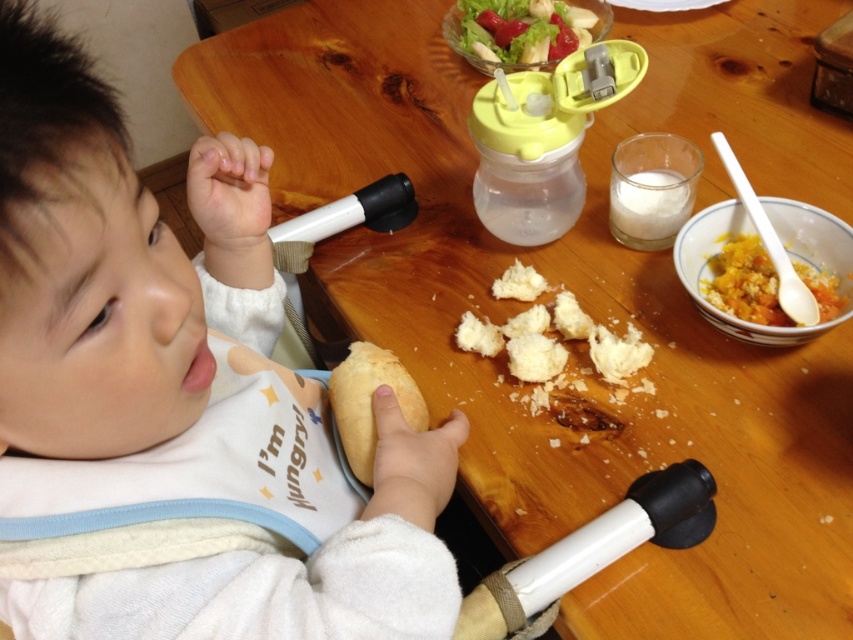
Who is higher up, fresh green lettuce at upper center or orange mashed food at right?

fresh green lettuce at upper center

Can you confirm if fresh green lettuce at upper center is positioned below orange mashed food at right?

Incorrect, fresh green lettuce at upper center is not positioned below orange mashed food at right.

At what (x,y) coordinates should I click in order to perform the action: click on fresh green lettuce at upper center. Please return your answer as a coordinate pair (x, y). Looking at the image, I should click on (521, 29).

Locate an element on the screen. The image size is (853, 640). white soft bread at lower right is located at coordinates (125, 278).

This screenshot has width=853, height=640. In order to click on white soft bread at lower right in this screenshot , I will do `click(125, 278)`.

Which is more to the left, soft white bread at lower center or orange mashed food at right?

From the viewer's perspective, soft white bread at lower center appears more on the left side.

Who is taller, soft white bread at lower center or orange mashed food at right?

soft white bread at lower center is taller.

Does point (389, 365) come farther from viewer compared to point (820, 310)?

No, (389, 365) is in front of (820, 310).

The image size is (853, 640). I want to click on soft white bread at lower center, so click(x=369, y=403).